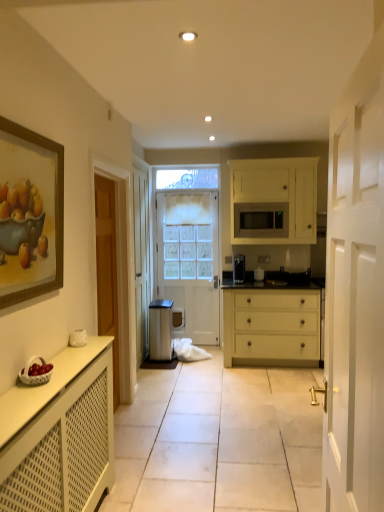
Measure the distance between white glossy radiator at lower left and camera.

white glossy radiator at lower left and camera are 7.26 feet apart.

The width and height of the screenshot is (384, 512). What do you see at coordinates (30, 214) in the screenshot?
I see `gold-framed painting at upper left` at bounding box center [30, 214].

Find the location of a particular element. Image resolution: width=384 pixels, height=512 pixels. white glossy radiator at lower left is located at coordinates (219, 440).

From a real-world perspective, is white matte cabinet at upper right, which is the 2th cabinetry from front to back, beneath white wicker basket at lower left?

Actually, white matte cabinet at upper right, which is the 2th cabinetry from front to back, is physically above white wicker basket at lower left in the real world.

Between white matte cabinet at upper right, which is counted as the 1th cabinetry, starting from the back, and white wicker basket at lower left, which one has larger size?

white matte cabinet at upper right, which is counted as the 1th cabinetry, starting from the back, is bigger.

Is white wicker basket at lower left completely or partially inside white matte cabinet at upper right, which is counted as the 1th cabinetry, starting from the back?

Definitely not — white wicker basket at lower left is not inside white matte cabinet at upper right, which is counted as the 1th cabinetry, starting from the back.

Is point (305, 187) positioned in front of point (37, 377)?

No, (305, 187) is further to viewer.

Is point (174, 227) farther from viewer compared to point (282, 267)?

Yes, it is behind point (282, 267).

Is black glossy sink at center completely or partially inside white frosted glass door at center?

A: No, black glossy sink at center is not surrounded by white frosted glass door at center.

Between white frosted glass door at center and black glossy sink at center, which one appears on the left side from the viewer's perspective?

Positioned to the left is white frosted glass door at center.

What's the angular difference between white frosted glass door at center and black glossy sink at center's facing directions?

2.34 degrees.

Which of these two, white matte screen door at center or gold-framed painting at upper left, stands taller?

With more height is white matte screen door at center.

Which object is positioned more to the left, white matte screen door at center or gold-framed painting at upper left?

gold-framed painting at upper left.

Is gold-framed painting at upper left at the back of white matte screen door at center?

No, white matte screen door at center is not facing away from gold-framed painting at upper left.

Does white matte screen door at center have a greater width compared to gold-framed painting at upper left?

Yes.

From a real-world perspective, which object rests below the other?

matte black coffee maker at center.

Would you say matte black coffee maker at center is outside white matte screen door at center?

matte black coffee maker at center lies outside white matte screen door at center's area.

Is matte black coffee maker at center positioned with its back to white matte screen door at center?

No.

Considering the sizes of objects matte black coffee maker at center and white matte screen door at center in the image provided, who is taller, matte black coffee maker at center or white matte screen door at center?

white matte screen door at center.

Would you say white matte radiator at lower left, which is the second cabinetry in top-to-bottom order, is outside matte black microwave at upper right?

Yes, white matte radiator at lower left, which is the second cabinetry in top-to-bottom order, is located beyond the bounds of matte black microwave at upper right.

From a real-world perspective, which object stands above the other?

matte black microwave at upper right is physically above.

Which point is more distant from viewer, (35,442) or (236,213)?

The point (236,213) is farther from the camera.

From the image's perspective, which object appears higher, white matte radiator at lower left, which appears as the first cabinetry when viewed from the front, or matte black microwave at upper right?

matte black microwave at upper right appears higher in the image.

Looking at this image, which of these two, white glossy radiator at lower left or white matte screen door at center, stands shorter?

white glossy radiator at lower left is shorter.

How many degrees apart are the facing directions of white glossy radiator at lower left and white matte screen door at center?

176 degrees.

Which object is positioned more to the right, white glossy radiator at lower left or white matte screen door at center?

Positioned to the right is white matte screen door at center.

In the scene shown: Is white glossy radiator at lower left looking in the opposite direction of white matte screen door at center?

white glossy radiator at lower left is not turned away from white matte screen door at center.

Is white frosted glass door at center facing towards white matte cabinet at upper right, arranged as the first cabinetry when viewed from the top?

No.

In the scene shown: In the image, is white frosted glass door at center on the left side or the right side of white matte cabinet at upper right, which is counted as the 1th cabinetry, starting from the back?

white frosted glass door at center is to the left of white matte cabinet at upper right, which is counted as the 1th cabinetry, starting from the back.

Is white matte cabinet at upper right, the 2th cabinetry positioned from the bottom, completely or partially inside white frosted glass door at center?

Definitely not — white matte cabinet at upper right, the 2th cabinetry positioned from the bottom, is not inside white frosted glass door at center.

Is white frosted glass door at center shorter than white matte cabinet at upper right, which ranks as the 1th cabinetry in right-to-left order?

Incorrect, the height of white frosted glass door at center does not fall short of that of white matte cabinet at upper right, which ranks as the 1th cabinetry in right-to-left order.

The image size is (384, 512). Identify the location of cabinetry that is above the white wicker basket at lower left (from the image's perspective). (276, 198).

Find the location of a particular element. The image size is (384, 512). door to the left of black glossy sink at center is located at coordinates (189, 260).

From the image, which object appears to be nearer to metallic trash bin at center, white matte drawer at center or white matte radiator at lower left, which appears as the first cabinetry when viewed from the front?

The object closer to metallic trash bin at center is white matte drawer at center.

When comparing their distances from white glossy radiator at lower left, does black glossy sink at center or white matte cabinet at upper right, which is the 2th cabinetry from front to back, seem further?

Based on the image, white matte cabinet at upper right, which is the 2th cabinetry from front to back, appears to be further to white glossy radiator at lower left.

Which object lies further to the anchor point metallic trash bin at center, matte black coffee maker at center or matte black microwave at upper right?

matte black microwave at upper right.

Estimate the real-world distances between objects in this image. Which object is further from gold-framed painting at upper left, white matte drawer at center or white matte radiator at lower left, the second cabinetry positioned from the back?

white matte drawer at center is positioned further to the anchor gold-framed painting at upper left.

From the image, which object appears to be nearer to matte black coffee maker at center, white glossy radiator at lower left or matte black microwave at upper right?

matte black microwave at upper right lies closer to matte black coffee maker at center than the other object.

Which object lies further to the anchor point white frosted glass door at center, metallic trash bin at center or white wicker basket at lower left?

Based on the image, white wicker basket at lower left appears to be further to white frosted glass door at center.

When comparing their distances from black glossy sink at center, does metallic trash bin at center or gold-framed painting at upper left seem further?

gold-framed painting at upper left is positioned further to the anchor black glossy sink at center.

Looking at the image, which one is located closer to white wicker basket at lower left, white matte radiator at lower left, the 2th cabinetry viewed from the right, or matte black microwave at upper right?

white matte radiator at lower left, the 2th cabinetry viewed from the right, is positioned closer to the anchor white wicker basket at lower left.

Locate an element on the screen. appliance between white frosted glass door at center and black glossy sink at center is located at coordinates (259, 274).

Find the location of a particular element. This screenshot has height=512, width=384. cabinetry positioned between white matte radiator at lower left, the 2th cabinetry viewed from the right, and matte black microwave at upper right from near to far is located at coordinates (276, 198).

Where is `drawer located between gold-framed painting at upper left and white frosted glass door at center in the depth direction`? This screenshot has width=384, height=512. drawer located between gold-framed painting at upper left and white frosted glass door at center in the depth direction is located at coordinates (272, 325).

I want to click on path between gold-framed painting at upper left and white frosted glass door at center in the front-back direction, so click(x=219, y=440).